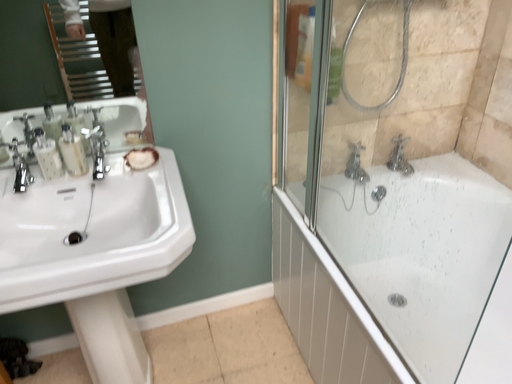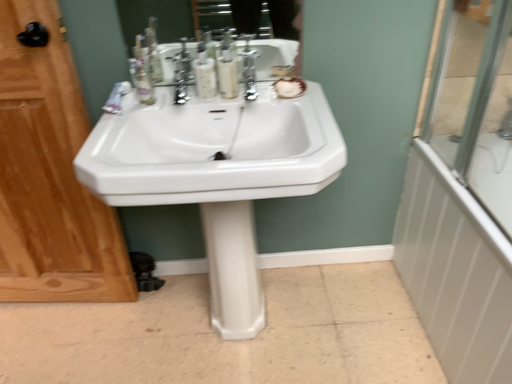
Question: How did the camera likely rotate when shooting the video?

Choices:
 (A) rotated left
 (B) rotated right

Answer: (A)